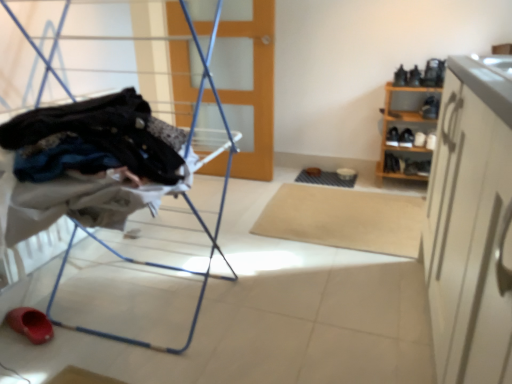
Where is `free space to the back side of metal laundry rack at left`? Image resolution: width=512 pixels, height=384 pixels. free space to the back side of metal laundry rack at left is located at coordinates (200, 228).